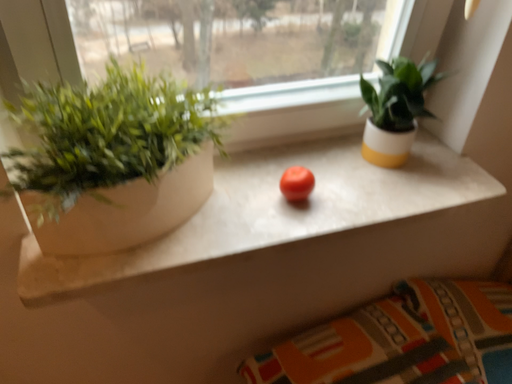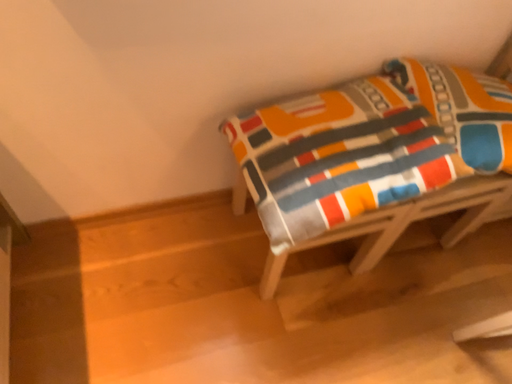
Question: Which way did the camera rotate in the video?

Choices:
 (A) rotated upward
 (B) rotated downward

Answer: (B)